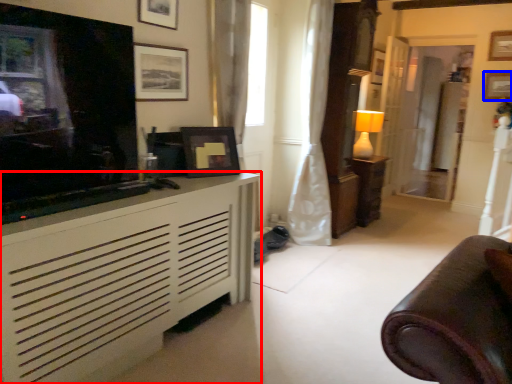
Question: Which object appears closest to the camera in this image, cabinetry (highlighted by a red box) or picture frame (highlighted by a blue box)?

Choices:
 (A) cabinetry
 (B) picture frame

Answer: (A)